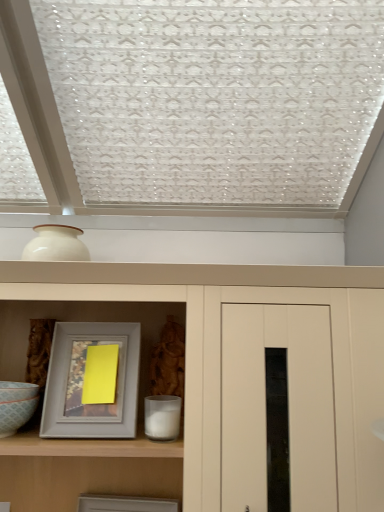
Question: From a real-world perspective, is matte gray picture frame at lower center, the 1th picture frame positioned from the bottom, physically located above or below matte white bowl at lower left?

Choices:
 (A) above
 (B) below

Answer: (B)

Question: Which is correct: matte gray picture frame at lower center, the 1th picture frame positioned from the bottom, is inside matte white bowl at lower left, or outside of it?

Choices:
 (A) inside
 (B) outside

Answer: (B)

Question: Which of these objects is positioned farthest from the matte white cupboard at center?

Choices:
 (A) matte white bowl at lower left
 (B) matte gray picture frame at lower center, the second picture frame viewed from the top
 (C) gray matte picture frame at center, the 1th picture frame when ordered from top to bottom

Answer: (B)

Question: Which is farther from the matte gray picture frame at lower center, the 1th picture frame positioned from the bottom?

Choices:
 (A) matte white bowl at lower left
 (B) gray matte picture frame at center, the 1th picture frame when ordered from top to bottom
 (C) matte white cupboard at center

Answer: (C)